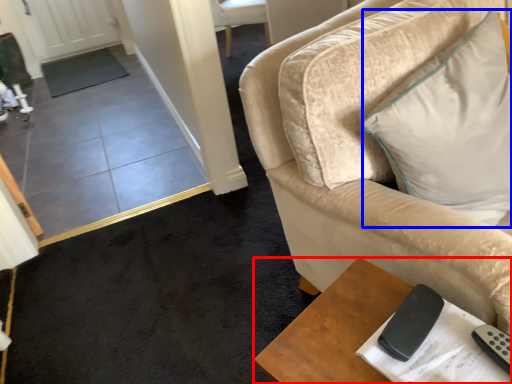
Question: Which object is closer to the camera taking this photo, table (highlighted by a red box) or pillow (highlighted by a blue box)?

Choices:
 (A) table
 (B) pillow

Answer: (A)